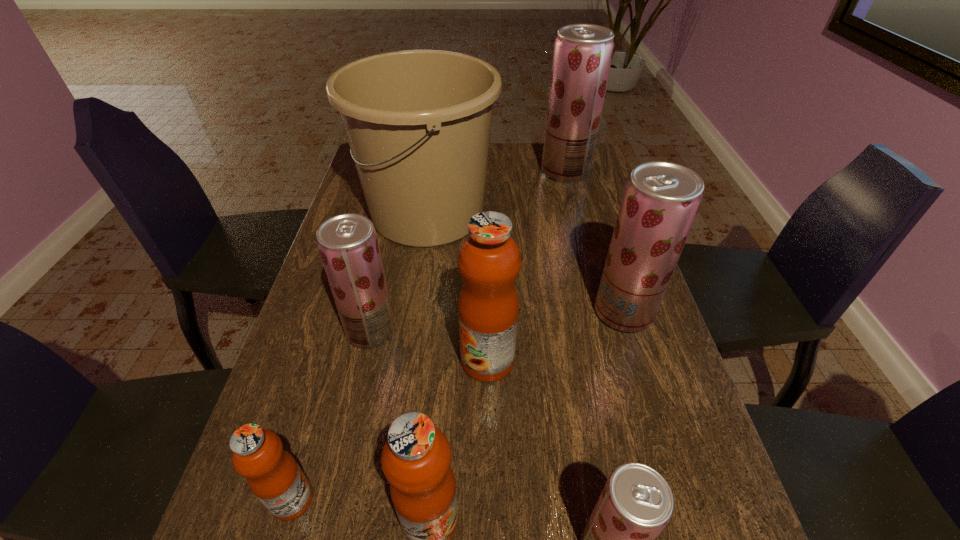
Select which object is the fourth closest to the smallest orange fruit juice. Please provide its 2D coordinates. Your answer should be formatted as a tuple, i.e. [(x, y)], where the tuple contains the x and y coordinates of a point satisfying the conditions above.

[(636, 503)]

This screenshot has height=540, width=960. Find the location of `object that is the second closest one to the farthest orange fruit juice`. object that is the second closest one to the farthest orange fruit juice is located at coordinates point(661,199).

Locate which fruit juice ranks sixth in proximity to the third biggest strawberry fruit juice. Please provide its 2D coordinates. Your answer should be formatted as a tuple, i.e. [(x, y)], where the tuple contains the x and y coordinates of a point satisfying the conditions above.

[(582, 57)]

Identify the location of fruit juice identified as the second closest to the smallest strawberry fruit juice. 489,260.

Point out which strawberry fruit juice is positioned as the third nearest to the third biggest strawberry fruit juice. Please provide its 2D coordinates. Your answer should be formatted as a tuple, i.e. [(x, y)], where the tuple contains the x and y coordinates of a point satisfying the conditions above.

[(582, 57)]

Choose which strawberry fruit juice is the third nearest neighbor to the leftmost strawberry fruit juice. Please provide its 2D coordinates. Your answer should be formatted as a tuple, i.e. [(x, y)], where the tuple contains the x and y coordinates of a point satisfying the conditions above.

[(582, 57)]

Point out which orange fruit juice is positioned as the second nearest to the third biggest strawberry fruit juice. Please provide its 2D coordinates. Your answer should be formatted as a tuple, i.e. [(x, y)], where the tuple contains the x and y coordinates of a point satisfying the conditions above.

[(273, 475)]

The image size is (960, 540). In order to click on orange fruit juice that is the third closest to the farthest strawberry fruit juice in this screenshot , I will do `click(273, 475)`.

Locate an element on the screen. The width and height of the screenshot is (960, 540). free space that satisfies the following two spatial constraints: 1. on the front side of the tallest fruit juice; 2. on the right side of the third smallest strawberry fruit juice is located at coordinates click(603, 312).